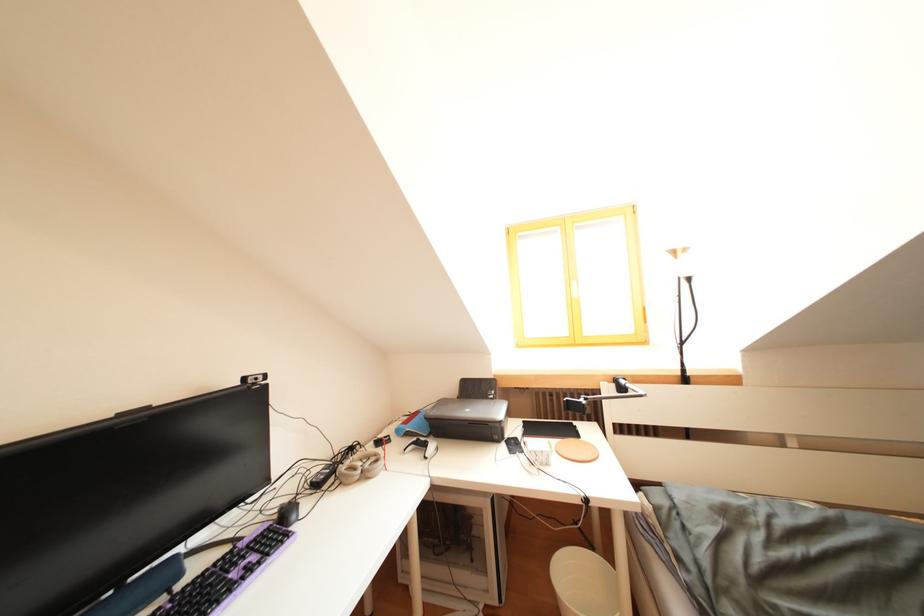
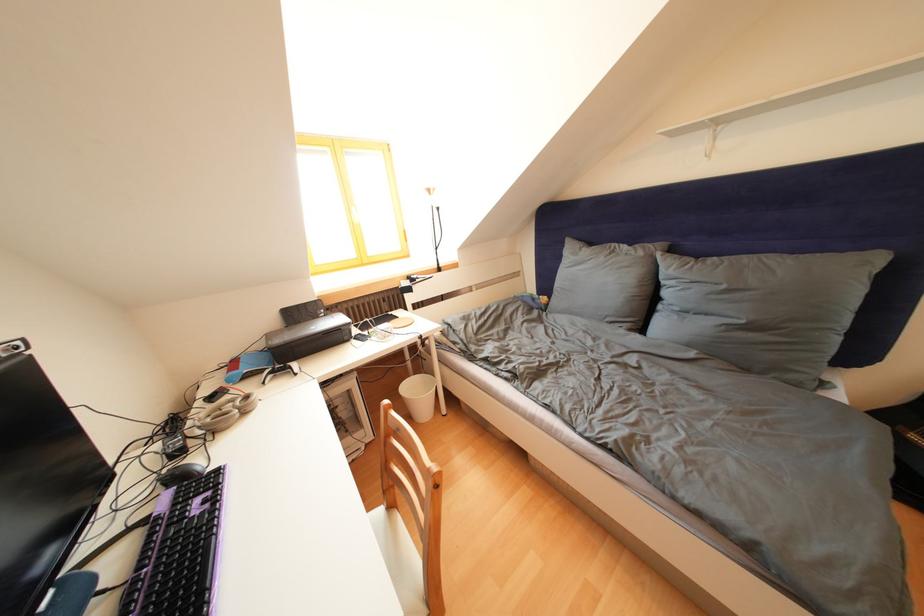
Find the pixel in the second image that matches (x=492, y=400) in the first image.

(323, 322)